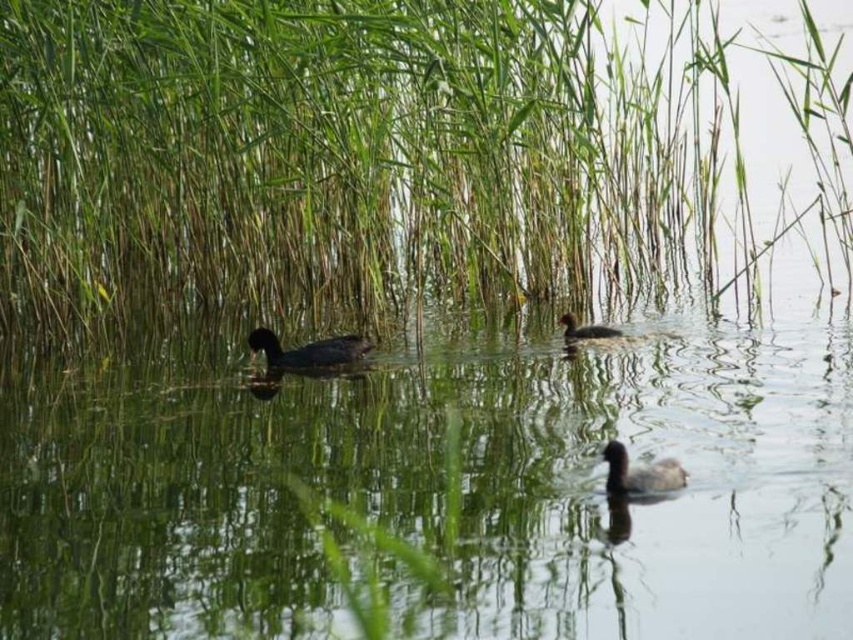
Question: Which point is farther to the camera?

Choices:
 (A) black matte duck at center
 (B) dark brown feathers at center
 (C) dark gray matte duck at lower right

Answer: (B)

Question: Can you confirm if black matte duck at center is positioned to the right of dark gray matte duck at lower right?

Choices:
 (A) yes
 (B) no

Answer: (B)

Question: From the image, what is the correct spatial relationship of green leafy grass at center in relation to dark brown feathers at center?

Choices:
 (A) above
 (B) below

Answer: (A)

Question: Which is nearer to the dark brown feathers at center?

Choices:
 (A) dark gray matte duck at lower right
 (B) dark brown matte duck at center

Answer: (B)

Question: Can you confirm if green leafy grass at center is thinner than black matte duck at center?

Choices:
 (A) no
 (B) yes

Answer: (B)

Question: Which object is positioned closest to the dark brown matte duck at center?

Choices:
 (A) green leafy grass at center
 (B) black matte duck at center
 (C) dark gray matte duck at lower right

Answer: (A)